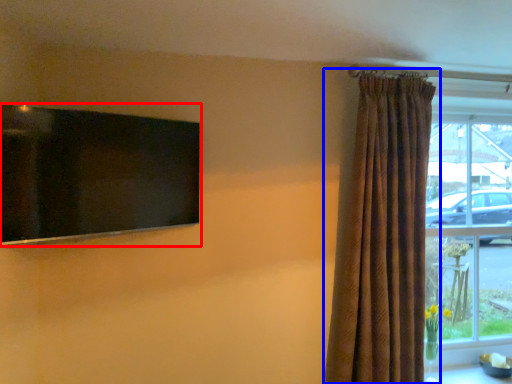
Question: Among these objects, which one is farthest to the camera, window screen (highlighted by a red box) or curtain (highlighted by a blue box)?

Choices:
 (A) window screen
 (B) curtain

Answer: (B)